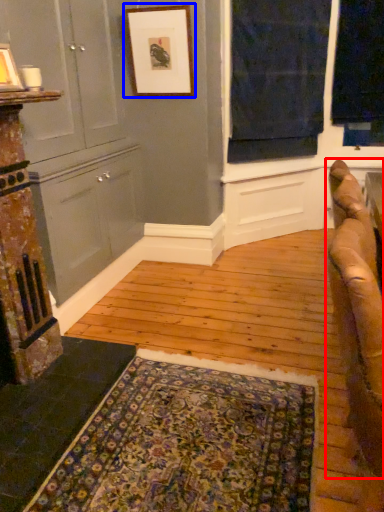
Question: Which object is further to the camera taking this photo, studio couch (highlighted by a red box) or picture frame (highlighted by a blue box)?

Choices:
 (A) studio couch
 (B) picture frame

Answer: (B)